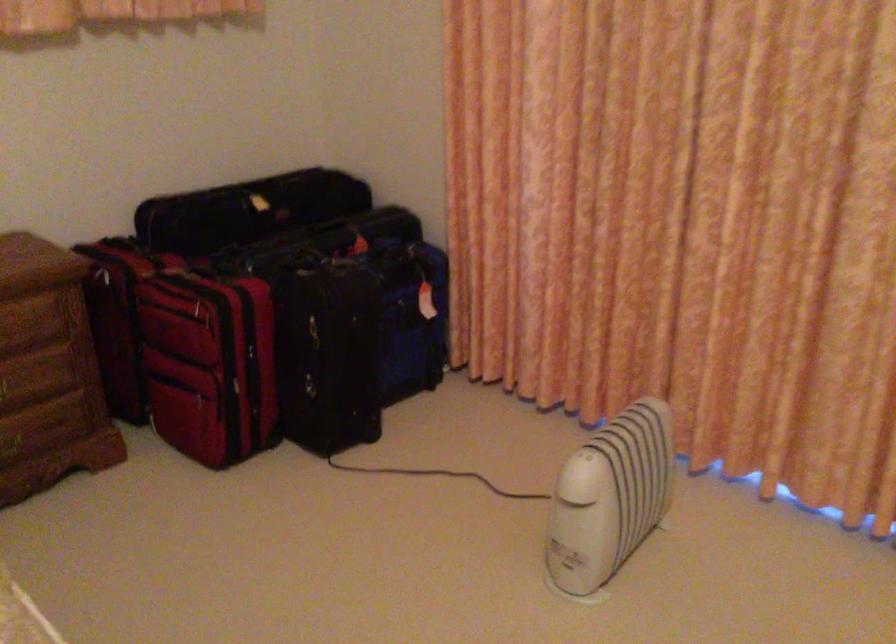
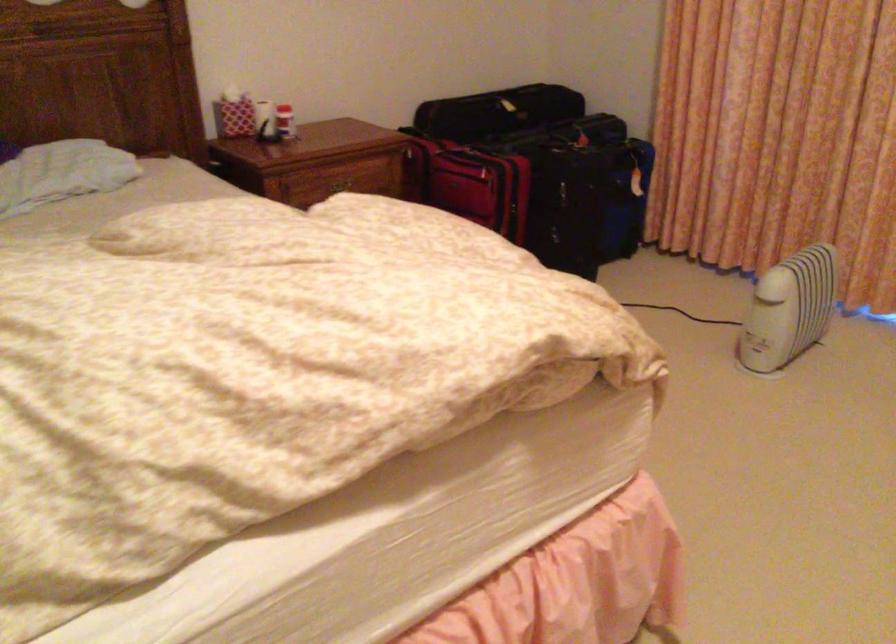
In the second image, find the point that corresponds to the point at 415,330 in the first image.

(625, 199)